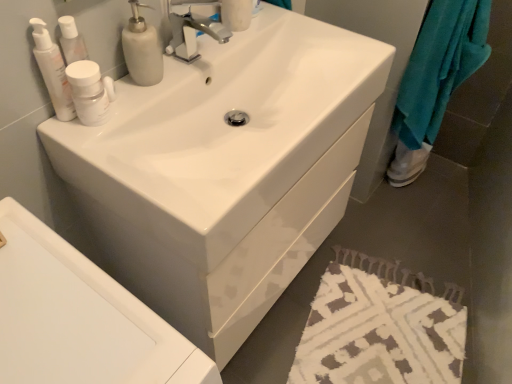
The image size is (512, 384). I want to click on free space that is in between white matte soap dispenser at upper left and white matte bottle at upper left, which appears as the 1th mouthwash when viewed from the right, so click(132, 104).